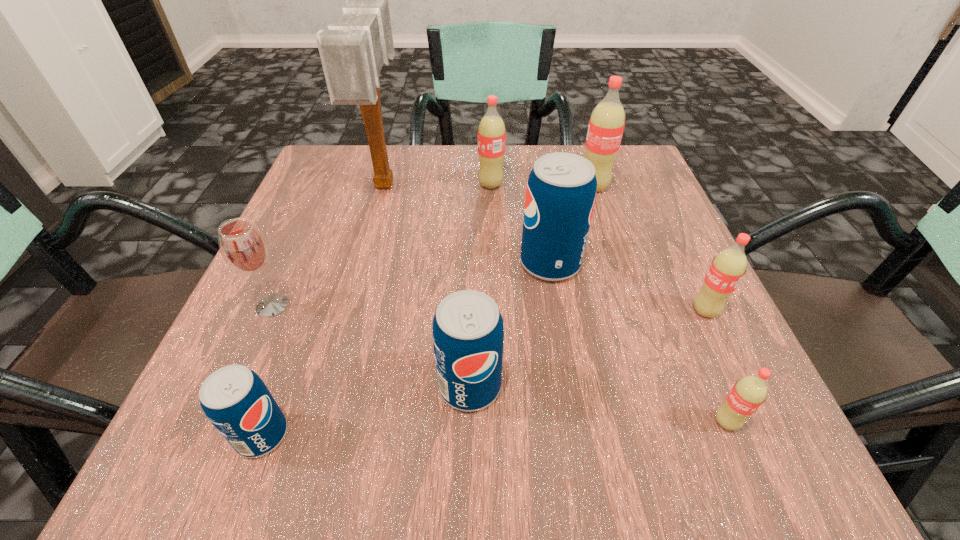
Identify the location of mallet. (352, 52).

Where is `the third object from left to right`? The height and width of the screenshot is (540, 960). the third object from left to right is located at coordinates (352, 52).

This screenshot has height=540, width=960. I want to click on the biggest red soda, so click(x=606, y=125).

Where is `the third soda from right to left`? the third soda from right to left is located at coordinates (606, 125).

Image resolution: width=960 pixels, height=540 pixels. What are the coordinates of `the fourth farthest object` in the screenshot? It's located at (560, 196).

Locate an element on the screen. the fifth nearest soda is located at coordinates (560, 196).

I want to click on the second biggest red soda, so pyautogui.click(x=491, y=132).

Locate an element on the screen. wineglass is located at coordinates (244, 248).

In order to click on the second smallest blue pop in this screenshot , I will do `click(468, 334)`.

The image size is (960, 540). Find the location of `the rightmost red soda`. the rightmost red soda is located at coordinates (728, 267).